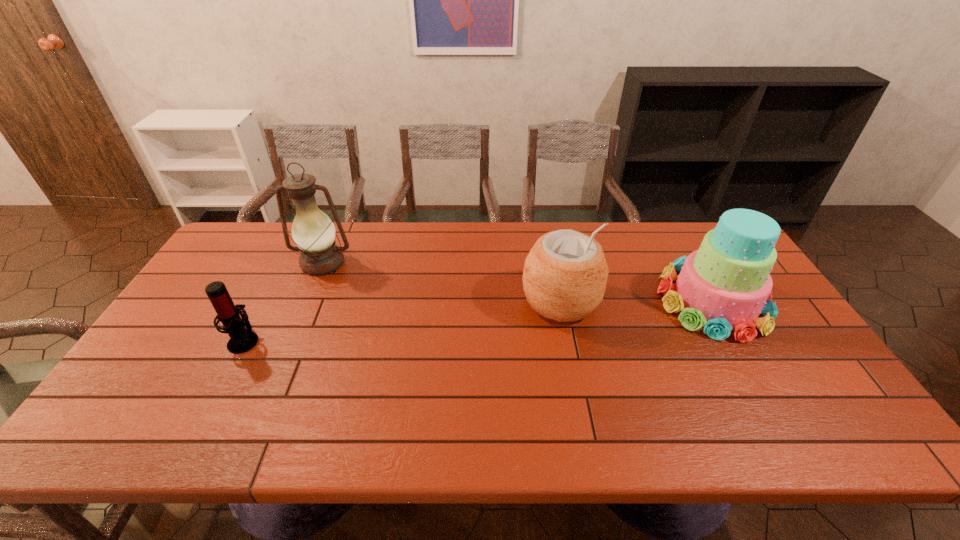
The width and height of the screenshot is (960, 540). What are the coordinates of `oil lamp` in the screenshot? It's located at [x=313, y=232].

Where is `coconut`? This screenshot has width=960, height=540. coconut is located at coordinates (565, 274).

Locate an element on the screen. the rightmost object is located at coordinates (725, 285).

At what (x,y) coordinates should I click in order to perform the action: click on the shortest object. Please return your answer as a coordinate pair (x, y). Image resolution: width=960 pixels, height=540 pixels. Looking at the image, I should click on (242, 339).

The width and height of the screenshot is (960, 540). I want to click on vacant space situated on the left of the tallest object, so click(261, 263).

In order to click on vacant position located 0.190m on the left of the coconut in this screenshot , I will do `click(457, 301)`.

I want to click on blank space located 0.110m on the front of the rightmost object, so click(x=756, y=378).

Identify the location of free space located 0.050m on the back of the microphone. The height and width of the screenshot is (540, 960). (258, 314).

The image size is (960, 540). I want to click on object present at the far edge, so click(313, 232).

I want to click on object situated at the right edge, so click(725, 285).